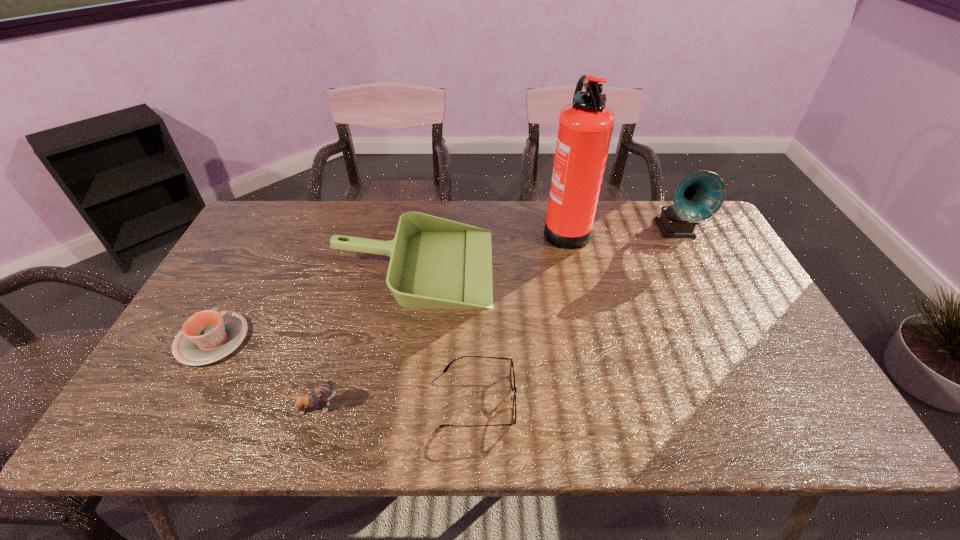
The width and height of the screenshot is (960, 540). In order to click on the tallest object in this screenshot , I will do `click(585, 128)`.

Where is `the fifth object from left to right`? Image resolution: width=960 pixels, height=540 pixels. the fifth object from left to right is located at coordinates (585, 128).

This screenshot has height=540, width=960. Find the location of `phonograph_record`. phonograph_record is located at coordinates (700, 195).

What are the coordinates of `the rightmost object` in the screenshot? It's located at pyautogui.click(x=700, y=195).

The image size is (960, 540). Identify the location of dustpan. (435, 263).

The height and width of the screenshot is (540, 960). I want to click on kitten, so click(x=323, y=391).

In order to click on the second shortest object in this screenshot , I will do `click(208, 336)`.

Find the location of a particular element. The height and width of the screenshot is (540, 960). the leftmost object is located at coordinates (208, 336).

Find the location of a particular element. The image size is (960, 540). spectacles is located at coordinates (512, 374).

Identify the location of vacant space located 0.130m at the nozzle of the fifth object from left to right. (503, 228).